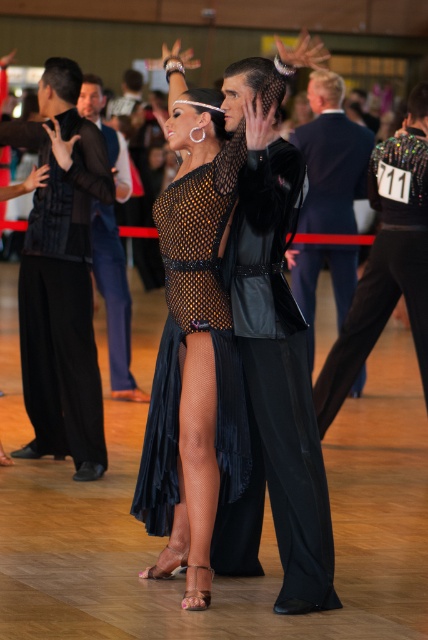
Who is shorter, black velvet vest at left or velvet suit at center?

velvet suit at center

Does point (41, 241) come farther from viewer compared to point (347, 288)?

That is False.

Find the location of a particular element. This screenshot has height=640, width=428. black velvet vest at left is located at coordinates (62, 276).

Is black velvet vest at left smaller than velvet black suit at center?

Incorrect, black velvet vest at left is not smaller in size than velvet black suit at center.

Is black velvet vest at left further to the viewer compared to velvet black suit at center?

No, black velvet vest at left is in front of velvet black suit at center.

Is point (77, 356) more distant than point (91, 104)?

No, (77, 356) is in front of (91, 104).

Identify the location of black velvet vest at left. (62, 276).

Between point (38, 401) and point (347, 352), which one is positioned in front?

Point (38, 401) is in front.

Locate an element on the screen. The image size is (428, 640). black velvet vest at left is located at coordinates (62, 276).

Locate an element on the screen. This screenshot has width=428, height=640. black velvet vest at left is located at coordinates (62, 276).